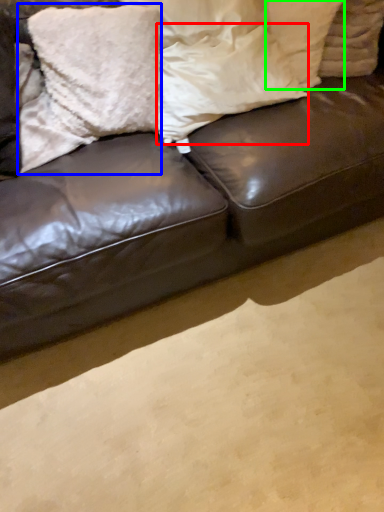
Question: Estimate the real-world distances between objects in this image. Which object is closer to pillow (highlighted by a red box), pillow (highlighted by a blue box) or pillow (highlighted by a green box)?

Choices:
 (A) pillow
 (B) pillow

Answer: (A)